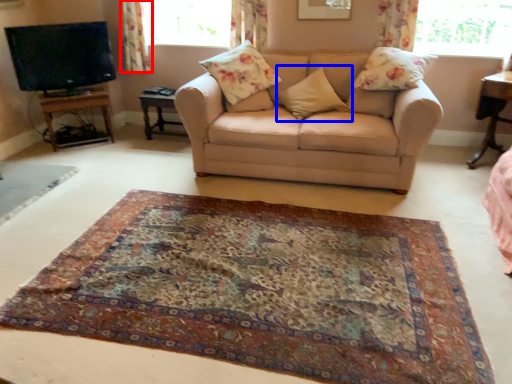
Question: Which point is further to the camera, curtain (highlighted by a red box) or pillow (highlighted by a blue box)?

Choices:
 (A) curtain
 (B) pillow

Answer: (A)